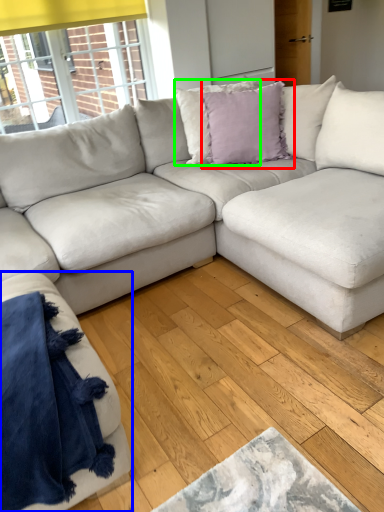
Question: Estimate the real-world distances between objects in this image. Which object is closer to pillow (highlighted by a red box), studio couch (highlighted by a blue box) or pillow (highlighted by a green box)?

Choices:
 (A) studio couch
 (B) pillow

Answer: (B)